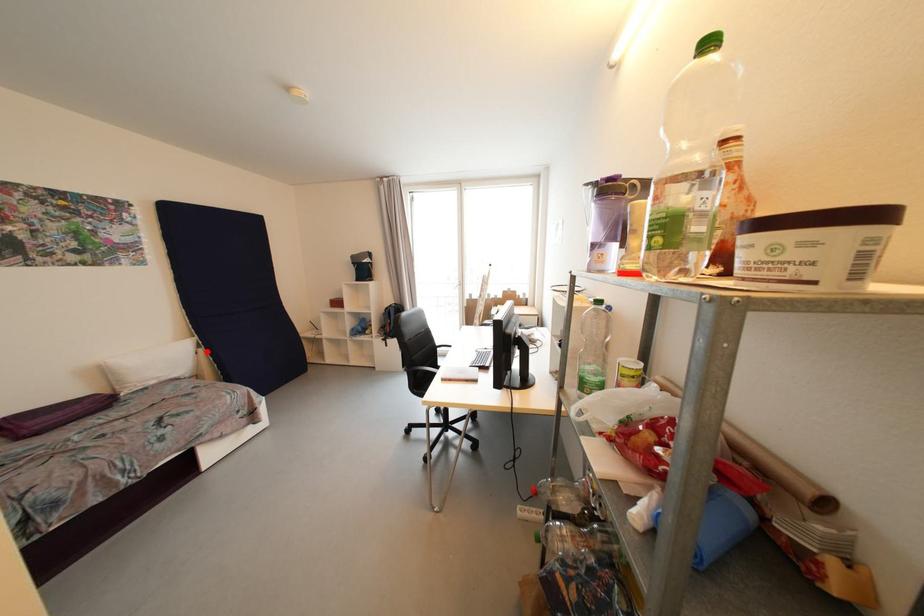
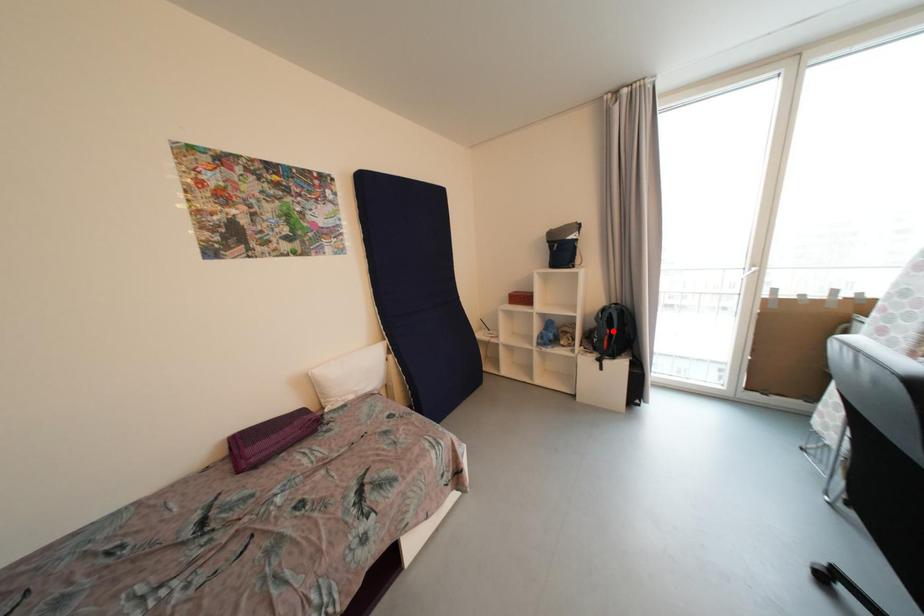
I am providing you with two images of the same scene from different viewpoints. A red point is marked on the first image and another point is marked on the second image. Do the highlighted points in image1 and image2 indicate the same real-world spot?

No